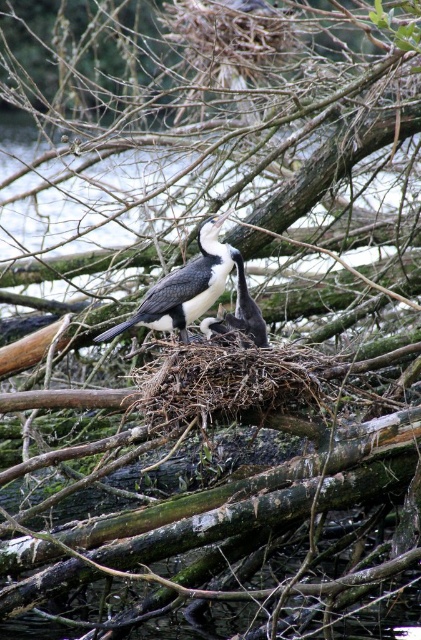
Can you confirm if white-feathered bird at center is bigger than white downy feathers at center?

Yes.

Who is positioned more to the left, white-feathered bird at center or white downy feathers at center?

white-feathered bird at center

Locate an element on the screen. This screenshot has width=421, height=640. white-feathered bird at center is located at coordinates (183, 288).

Where is `white-feathered bird at center`? white-feathered bird at center is located at coordinates (183, 288).